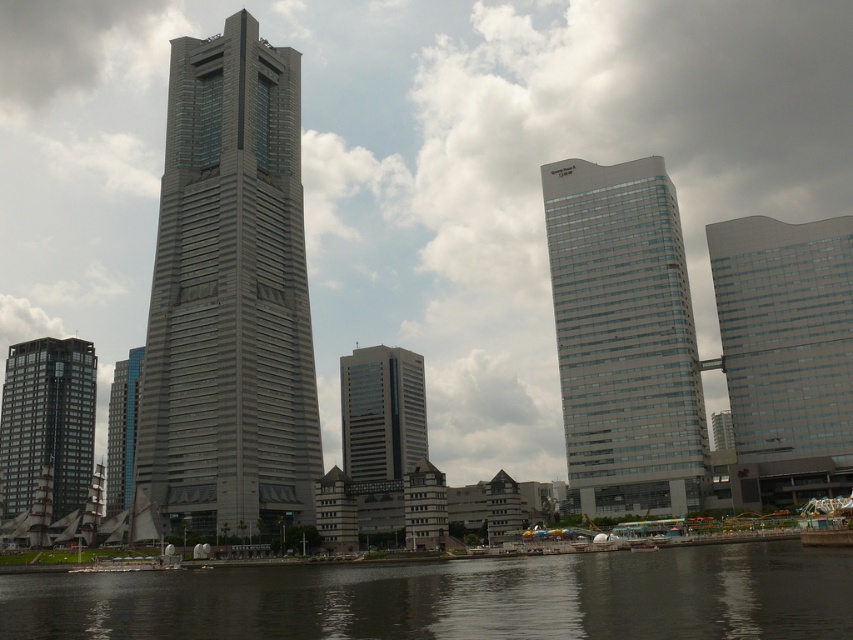
You are an architect analyzing the city skyline. You notice the dark gray glass building at left and the gray glass skyscraper at center. Which of these two buildings is positioned lower in the image?

The dark gray glass building at left is positioned below the gray glass skyscraper at center, so it is lower in the image.

Consider the image. You are standing in the city and see the skyscraper with reflective glass and the traditional high rise to its right. There is dark gray water at lower center located at point (457, 598). If you want to walk towards the dark gray water at lower center, which direction should you head relative to the skyscraper with reflective glass?

The dark gray water at lower center is located at point (457, 598), so you should head towards the lower center direction relative to the skyscraper with reflective glass.

You are a city planner analyzing the skyline. You observe the dark gray glass building at left and the gray glass skyscraper at center. Which structure has a greater height?

The dark gray glass building at left is taller than the gray glass skyscraper at center.